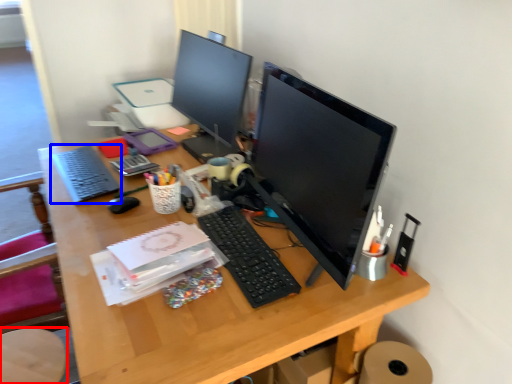
Question: Which object is closer to the camera taking this photo, computer chair (highlighted by a red box) or computer keyboard (highlighted by a blue box)?

Choices:
 (A) computer chair
 (B) computer keyboard

Answer: (A)